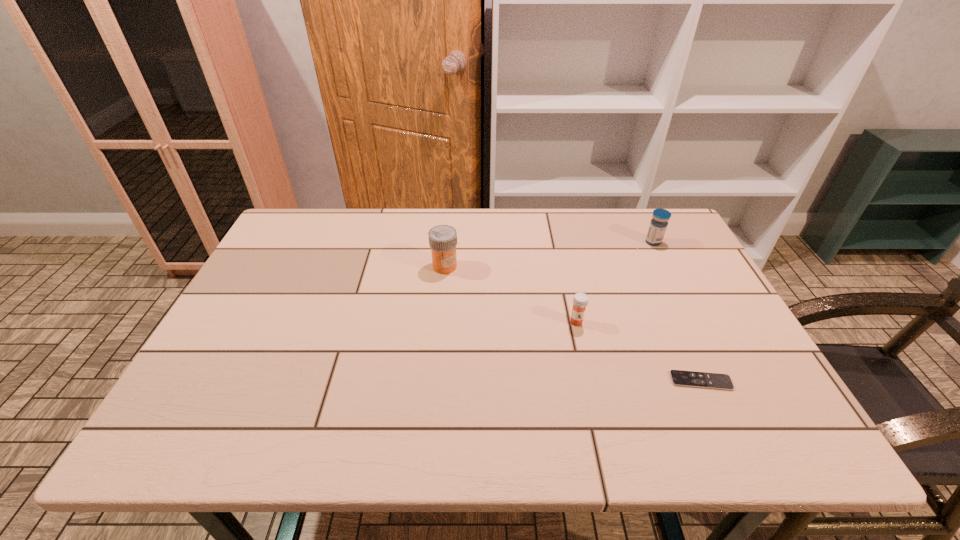
Identify the location of vacant area that lies between the nearest medicine and the leftmost object. The height and width of the screenshot is (540, 960). (511, 294).

Choose which object is the third nearest neighbor to the farthest object. Please provide its 2D coordinates. Your answer should be formatted as a tuple, i.e. [(x, y)], where the tuple contains the x and y coordinates of a point satisfying the conditions above.

[(442, 239)]

Where is `the second closest object relative to the farthest object`? The width and height of the screenshot is (960, 540). the second closest object relative to the farthest object is located at coordinates (679, 378).

Locate which medicine is the closest to the farthest object. Please provide its 2D coordinates. Your answer should be formatted as a tuple, i.e. [(x, y)], where the tuple contains the x and y coordinates of a point satisfying the conditions above.

[(580, 300)]

Identify which medicine is the nearest to the nearest object. Please provide its 2D coordinates. Your answer should be formatted as a tuple, i.e. [(x, y)], where the tuple contains the x and y coordinates of a point satisfying the conditions above.

[(580, 300)]

The image size is (960, 540). Identify the location of free location that satisfies the following two spatial constraints: 1. on the label side of the nearest medicine; 2. on the left side of the shortest object. (589, 381).

Where is `free point that satisfies the following two spatial constraints: 1. on the label side of the remote control; 2. on the left side of the second nearest object`? The height and width of the screenshot is (540, 960). free point that satisfies the following two spatial constraints: 1. on the label side of the remote control; 2. on the left side of the second nearest object is located at coordinates (589, 381).

The height and width of the screenshot is (540, 960). Identify the location of vacant region that satisfies the following two spatial constraints: 1. on the label side of the second farthest object; 2. on the left side of the remote control. (434, 381).

Identify the location of vacant point that satisfies the following two spatial constraints: 1. on the label side of the nearest object; 2. on the left side of the second shortest object. (589, 381).